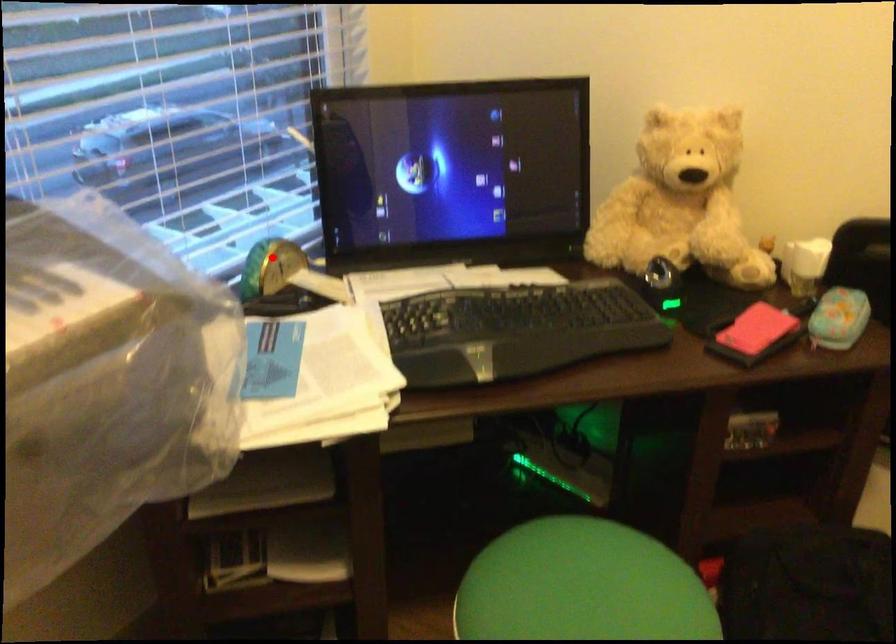
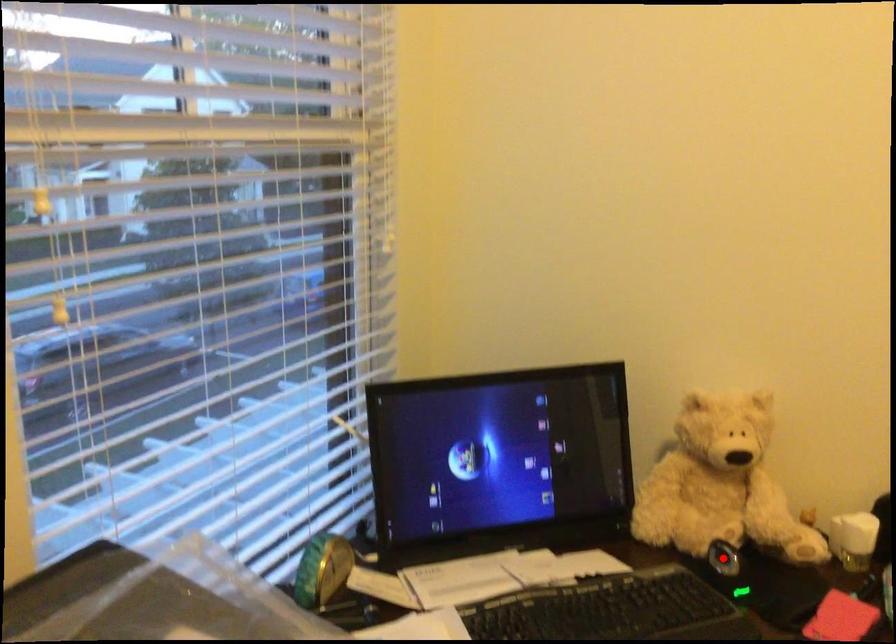
I am providing you with two images of the same scene from different viewpoints. A red point is marked on the first image and another point is marked on the second image. Are the points marked in image1 and image2 representing the same 3D position?

No